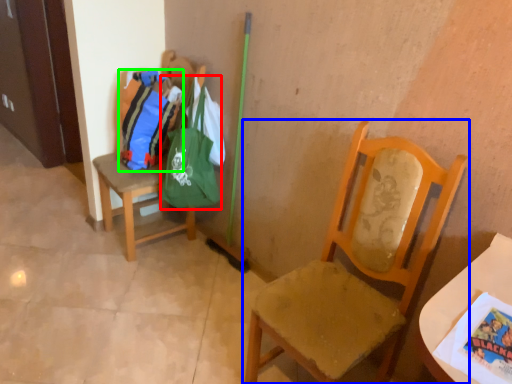
Question: Estimate the real-world distances between objects in this image. Which object is farther from bag (highlighted by a red box), chair (highlighted by a blue box) or bag (highlighted by a green box)?

Choices:
 (A) chair
 (B) bag

Answer: (A)